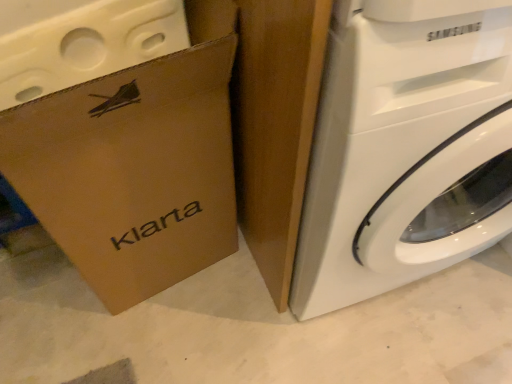
The width and height of the screenshot is (512, 384). What are the coordinates of `unoccupied area in front of brown cardboard box at left` in the screenshot? It's located at (153, 352).